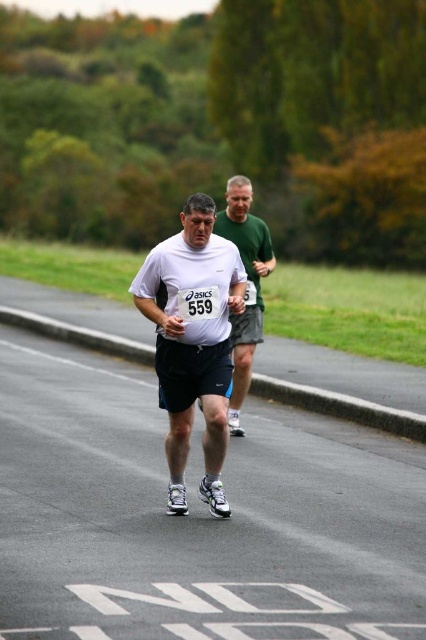
The width and height of the screenshot is (426, 640). I want to click on white matte shorts at center, so click(x=192, y=340).

Does point (187, 237) lie in front of point (233, 205)?

Yes, it is.

Is point (149, 284) more distant than point (242, 246)?

That is False.

Image resolution: width=426 pixels, height=640 pixels. Identify the location of white matte shorts at center. (192, 340).